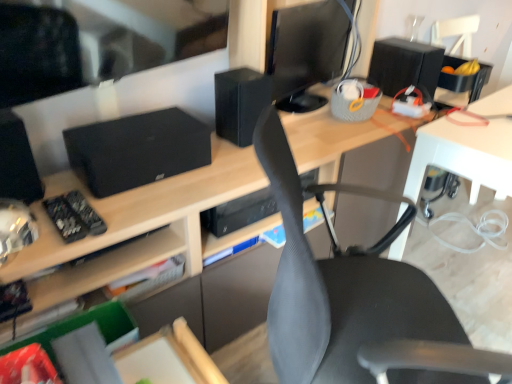
This screenshot has width=512, height=384. Find the location of `gray mesh chair at center`. gray mesh chair at center is located at coordinates (357, 299).

What do you see at coordinates (306, 52) in the screenshot?
I see `black glossy monitor at upper center` at bounding box center [306, 52].

Locate an element on the screen. black glossy monitor at upper center is located at coordinates (306, 52).

At what (x,y) coordinates should I click in order to perform the action: click on black matte speaker at upper right, placed as the first speaker when sorted from right to left. Please return your answer as a coordinate pair (x, y). Looking at the image, I should click on (405, 66).

The width and height of the screenshot is (512, 384). Describe the element at coordinates (65, 219) in the screenshot. I see `black matte remote control at left` at that location.

The height and width of the screenshot is (384, 512). What do you see at coordinates (240, 103) in the screenshot?
I see `black matte speaker at upper center, placed as the second speaker when sorted from left to right` at bounding box center [240, 103].

Locate an element on the screen. This screenshot has width=512, height=384. matte wood desk at center is located at coordinates (170, 246).

Is black matte speaker at upper center, which is the 2th speaker from right to left, looking in the opposite direction of black matte speaker at upper right, placed as the first speaker when sorted from right to left?

black matte speaker at upper center, which is the 2th speaker from right to left, is not turned away from black matte speaker at upper right, placed as the first speaker when sorted from right to left.

Does point (223, 74) come behind point (375, 43)?

No, (223, 74) is in front of (375, 43).

From a real-world perspective, which object rests below the other?

black matte speaker at upper right, arranged as the third speaker when viewed from the left, from a real-world perspective.

Is the depth of black matte speaker at upper center, which is the 2th speaker from right to left, less than that of black matte speaker at upper right, arranged as the third speaker when viewed from the left?

Yes, black matte speaker at upper center, which is the 2th speaker from right to left, is closer to the camera.

Considering the relative positions of black matte remote control at left and black matte speaker at upper right, placed as the first speaker when sorted from right to left, in the image provided, is black matte remote control at left to the right of black matte speaker at upper right, placed as the first speaker when sorted from right to left, from the viewer's perspective?

No.

From their relative heights in the image, would you say black matte remote control at left is taller or shorter than black matte speaker at upper right, arranged as the third speaker when viewed from the left?

In the image, black matte remote control at left appears to be shorter than black matte speaker at upper right, arranged as the third speaker when viewed from the left.

From a real-world perspective, which object stands above the other?

black matte speaker at upper right, placed as the first speaker when sorted from right to left, is physically above.

Between black glossy monitor at upper center and gray mesh chair at center, which one appears on the right side from the viewer's perspective?

gray mesh chair at center is more to the right.

Is black glossy monitor at upper center shorter than gray mesh chair at center?

Correct, black glossy monitor at upper center is not as tall as gray mesh chair at center.

From a real-world perspective, which object rests below the other?

gray mesh chair at center is physically lower.

Would you say black matte speaker at left, the 3th speaker positioned from the right, contains black matte remote control at left?

No, black matte remote control at left is not surrounded by black matte speaker at left, the 3th speaker positioned from the right.

Can you confirm if black matte speaker at left, placed as the first speaker when sorted from front to back, is bigger than black matte remote control at left?

Indeed, black matte speaker at left, placed as the first speaker when sorted from front to back, has a larger size compared to black matte remote control at left.

From a real-world perspective, is black matte speaker at left, which appears as the 1th speaker when viewed from the left, physically located above or below black matte remote control at left?

From a real-world perspective, black matte speaker at left, which appears as the 1th speaker when viewed from the left, is physically above black matte remote control at left.

From the image's perspective, between black matte speaker at left, the 3th speaker viewed from the back, and black matte remote control at left, which one is located above?

From the image's view, black matte speaker at left, the 3th speaker viewed from the back, is above.

Considering the points (23, 130) and (255, 81), which point is behind, point (23, 130) or point (255, 81)?

The point (255, 81) is farther from the camera.

From a real-world perspective, which object stands above the other?

black matte speaker at left, which appears as the 1th speaker when viewed from the left.

In the scene shown: From the image's perspective, which one is positioned lower, black matte speaker at left, which appears as the 1th speaker when viewed from the left, or black matte speaker at upper center, placed as the second speaker when sorted from left to right?

From the image's view, black matte speaker at left, which appears as the 1th speaker when viewed from the left, is below.

Can you confirm if black matte speaker at left, placed as the first speaker when sorted from front to back, is smaller than black matte speaker at upper center, which is the 2th speaker from right to left?

Correct, black matte speaker at left, placed as the first speaker when sorted from front to back, occupies less space than black matte speaker at upper center, which is the 2th speaker from right to left.

Between black matte speaker at left, placed as the first speaker when sorted from front to back, and gray mesh chair at center, which one has less height?

Standing shorter between the two is black matte speaker at left, placed as the first speaker when sorted from front to back.

Which is more to the right, black matte speaker at left, the 3th speaker viewed from the back, or gray mesh chair at center?

Positioned to the right is gray mesh chair at center.

Is black matte speaker at left, which appears as the 1th speaker when viewed from the left, turned away from gray mesh chair at center?

No, black matte speaker at left, which appears as the 1th speaker when viewed from the left,'s orientation is not away from gray mesh chair at center.

Is black matte speaker at left, the 3th speaker positioned from the right, next to gray mesh chair at center and touching it?

black matte speaker at left, the 3th speaker positioned from the right, and gray mesh chair at center are not in contact.

From the image's perspective, which is above, black matte remote control at left or gray mesh chair at center?

black matte remote control at left is shown above in the image.

Is black matte remote control at left far from gray mesh chair at center?

No, black matte remote control at left is in close proximity to gray mesh chair at center.

Considering the relative sizes of black matte remote control at left and gray mesh chair at center in the image provided, is black matte remote control at left taller than gray mesh chair at center?

In fact, black matte remote control at left may be shorter than gray mesh chair at center.

How different are the orientations of black matte remote control at left and gray mesh chair at center in degrees?

The angle between the facing direction of black matte remote control at left and the facing direction of gray mesh chair at center is 51.1 degrees.

Locate an element on the screen. Image resolution: width=512 pixels, height=384 pixels. speaker behind the black matte speaker at upper center, marked as the second speaker in a front-to-back arrangement is located at coordinates (405, 66).

This screenshot has width=512, height=384. In order to click on control located below the black matte speaker at upper right, acting as the third speaker starting from the front (from the image's perspective) in this screenshot , I will do `click(65, 219)`.

From the image, which object appears to be farther from black matte speaker at upper right, arranged as the third speaker when viewed from the left, black matte speaker at left, the 3th speaker viewed from the back, or matte wood desk at center?

black matte speaker at left, the 3th speaker viewed from the back.

Considering their positions, is gray mesh chair at center positioned further to black matte speaker at left, the 3th speaker viewed from the back, than black matte remote control at left?

Among the two, gray mesh chair at center is located further to black matte speaker at left, the 3th speaker viewed from the back.

Estimate the real-world distances between objects in this image. Which object is closer to black matte speaker at upper center, which is the 2th speaker from right to left, black matte remote control at left or black glossy monitor at upper center?

Among the two, black glossy monitor at upper center is located nearer to black matte speaker at upper center, which is the 2th speaker from right to left.

From the image, which object appears to be farther from matte wood desk at center, black glossy monitor at upper center or black matte remote control at left?

Based on the image, black matte remote control at left appears to be further to matte wood desk at center.

Considering their positions, is black matte speaker at left, the 3th speaker viewed from the back, positioned closer to matte wood desk at center than gray mesh chair at center?

gray mesh chair at center is positioned closer to the anchor matte wood desk at center.

Considering their positions, is black matte speaker at upper right, the first speaker in the back-to-front sequence, positioned further to gray mesh chair at center than matte wood desk at center?

Based on the image, black matte speaker at upper right, the first speaker in the back-to-front sequence, appears to be further to gray mesh chair at center.

Looking at the image, which one is located closer to gray mesh chair at center, black matte speaker at upper center, placed as the second speaker when sorted from left to right, or black matte speaker at left, which appears as the 1th speaker when viewed from the left?

Based on the image, black matte speaker at upper center, placed as the second speaker when sorted from left to right, appears to be nearer to gray mesh chair at center.

Considering their positions, is gray mesh chair at center positioned further to black matte speaker at left, the 3th speaker positioned from the right, than black matte speaker at upper right, placed as the first speaker when sorted from right to left?

black matte speaker at upper right, placed as the first speaker when sorted from right to left, lies further to black matte speaker at left, the 3th speaker positioned from the right, than the other object.

Find the location of a particular element. This screenshot has height=384, width=512. speaker between black matte remote control at left and black matte speaker at upper right, the first speaker in the back-to-front sequence, in the horizontal direction is located at coordinates (240, 103).

Find the location of a particular element. Image resolution: width=512 pixels, height=384 pixels. control between black matte speaker at left, the 3th speaker viewed from the back, and black matte speaker at upper center, which is the 2th speaker from right to left, in the horizontal direction is located at coordinates (65, 219).

Find the location of a particular element. speaker between black matte speaker at left, the 3th speaker viewed from the back, and black glossy monitor at upper center is located at coordinates (240, 103).

Image resolution: width=512 pixels, height=384 pixels. In order to click on chair situated between black matte speaker at left, which appears as the 1th speaker when viewed from the left, and black matte speaker at upper right, the first speaker in the back-to-front sequence, from left to right in this screenshot , I will do `click(357, 299)`.